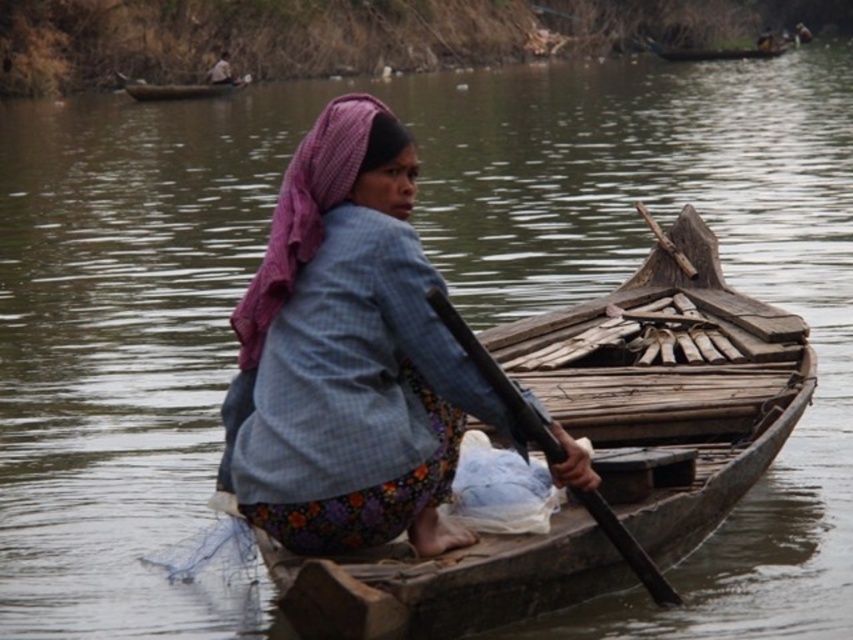
Which is more to the right, wooden boat at center or wooden boat at upper right?

wooden boat at upper right

This screenshot has width=853, height=640. I want to click on wooden boat at center, so click(669, 387).

The image size is (853, 640). I want to click on wooden boat at center, so click(669, 387).

Does wooden boat at center have a lesser width compared to blue plaid shirt at center?

No, wooden boat at center is not thinner than blue plaid shirt at center.

Based on the photo, does wooden boat at center have a smaller size compared to blue plaid shirt at center?

Actually, wooden boat at center might be larger than blue plaid shirt at center.

Is point (595, 545) closer to camera compared to point (329, 300)?

No, (595, 545) is behind (329, 300).

Locate an element on the screen. This screenshot has height=640, width=853. wooden boat at center is located at coordinates (669, 387).

Between point (576, 493) and point (132, 81), which one is positioned in front?

Point (576, 493) is in front.

Which is behind, point (489, 364) or point (190, 90)?

Positioned behind is point (190, 90).

This screenshot has width=853, height=640. I want to click on black wood paddle at center, so click(x=497, y=380).